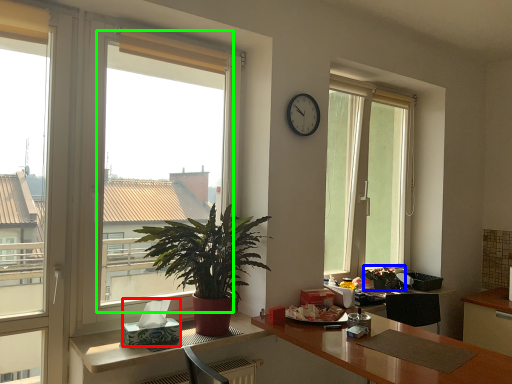
Question: Which object is positioned farthest from tissue paper (highlighted by a red box)? Select from houseplant (highlighted by a blue box) and bay window (highlighted by a green box).

Choices:
 (A) houseplant
 (B) bay window

Answer: (A)